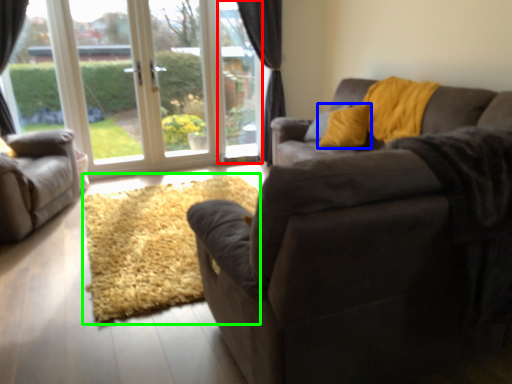
Question: Based on their relative distances, which object is nearer to window screen (highlighted by a red box)? Choose from throw pillow (highlighted by a blue box) and doormat (highlighted by a green box).

Choices:
 (A) throw pillow
 (B) doormat

Answer: (A)